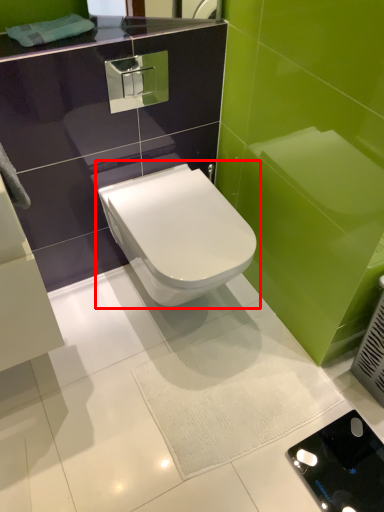
Question: From the image's perspective, considering the relative positions of toilet (annotated by the red box) and porcelain in the image provided, where is toilet (annotated by the red box) located with respect to the staircase?

Choices:
 (A) below
 (B) above

Answer: (B)